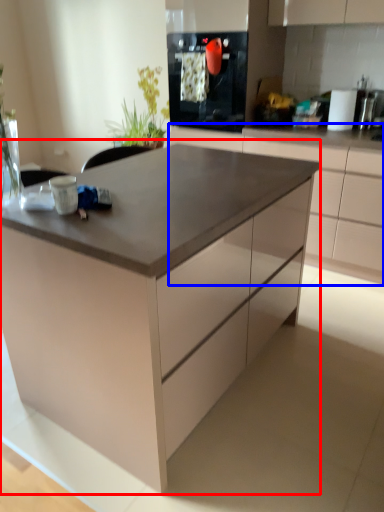
Question: Which of the following is the closest to the observer, table (highlighted by a red box) or cabinetry (highlighted by a blue box)?

Choices:
 (A) table
 (B) cabinetry

Answer: (A)